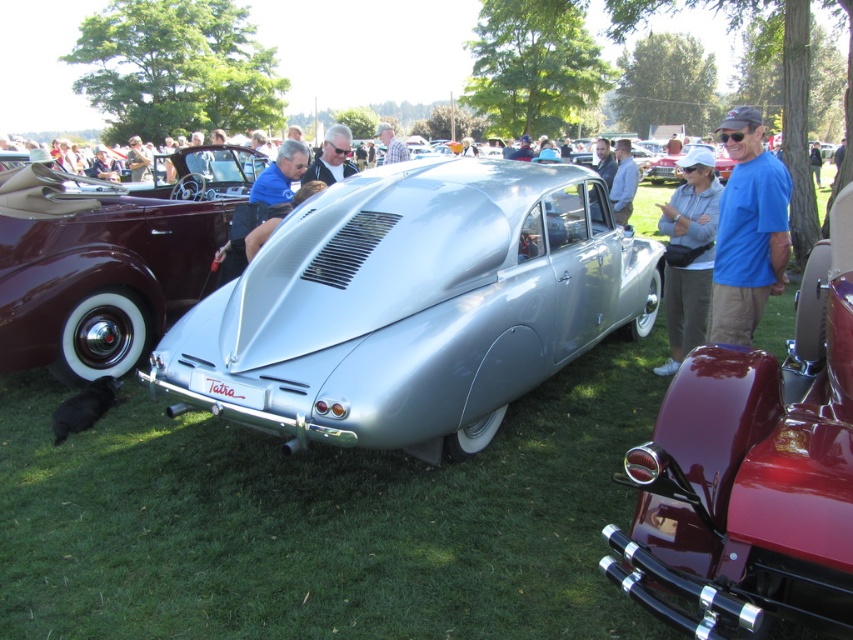
Question: In this image, where is sleek silver car at center located relative to blue cotton shirt at right?

Choices:
 (A) right
 (B) left

Answer: (B)

Question: Can you confirm if light gray fabric jacket at center is thinner than matte blue shirt at center?

Choices:
 (A) no
 (B) yes

Answer: (B)

Question: Which point is closer to the camera?

Choices:
 (A) shiny maroon convertible at center
 (B) plaid shirt at center
 (C) blue denim jeans at lower right

Answer: (A)

Question: Which object appears farthest from the camera in this image?

Choices:
 (A) light gray fabric jacket at center
 (B) sleek silver car at center
 (C) blue cotton shirt at right
 (D) blue denim shirt at center

Answer: (D)

Question: Which of these objects is positioned closest to the blue denim shirt at center?

Choices:
 (A) blue denim jeans at lower right
 (B) matte black jacket at center

Answer: (B)

Question: From the image, what is the correct spatial relationship of shiny maroon convertible at center in relation to blue denim jeans at lower right?

Choices:
 (A) below
 (B) above

Answer: (A)